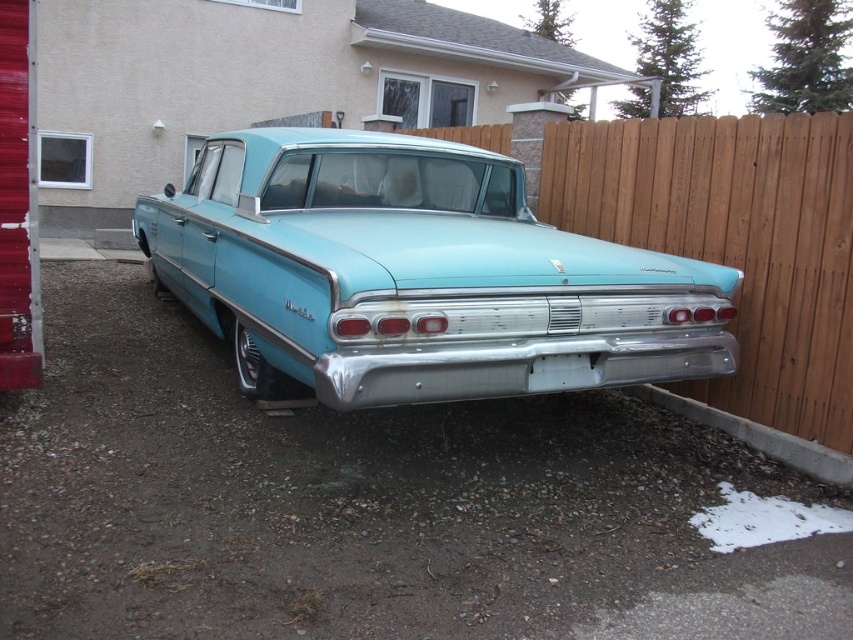
Can you confirm if smooth asphalt driveway at center is positioned above light blue metallic car at center?

No.

Is point (560, 506) positioned behind point (635, 268)?

No, it is not.

Is point (289, 604) closer to viewer compared to point (407, 170)?

Yes, it is.

Identify the location of smooth asphalt driveway at center. Image resolution: width=853 pixels, height=640 pixels. (367, 506).

Does point (276, 138) lie in front of point (776, 320)?

No, it is not.

Between point (318, 136) and point (596, 168), which one is positioned behind?

The point (596, 168) is more distant.

The image size is (853, 640). Find the location of `light blue metallic car at center`. light blue metallic car at center is located at coordinates (416, 275).

Can you confirm if smooth asphalt driveway at center is positioned to the right of wooden fence at right?

No, smooth asphalt driveway at center is not to the right of wooden fence at right.

Locate an element on the screen. smooth asphalt driveway at center is located at coordinates (367, 506).